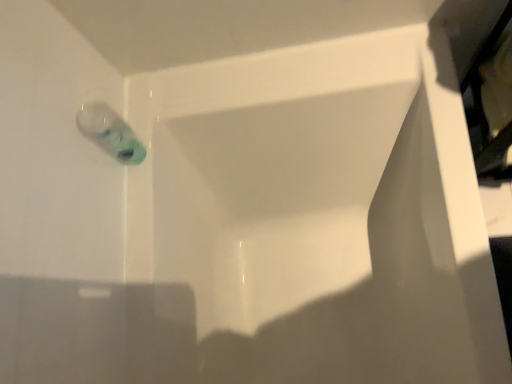
Image resolution: width=512 pixels, height=384 pixels. Describe the element at coordinates (110, 132) in the screenshot. I see `transparent plastic bottle at upper left` at that location.

Image resolution: width=512 pixels, height=384 pixels. I want to click on transparent plastic bottle at upper left, so click(110, 132).

This screenshot has width=512, height=384. Find the location of `transparent plastic bottle at upper left`. transparent plastic bottle at upper left is located at coordinates (110, 132).